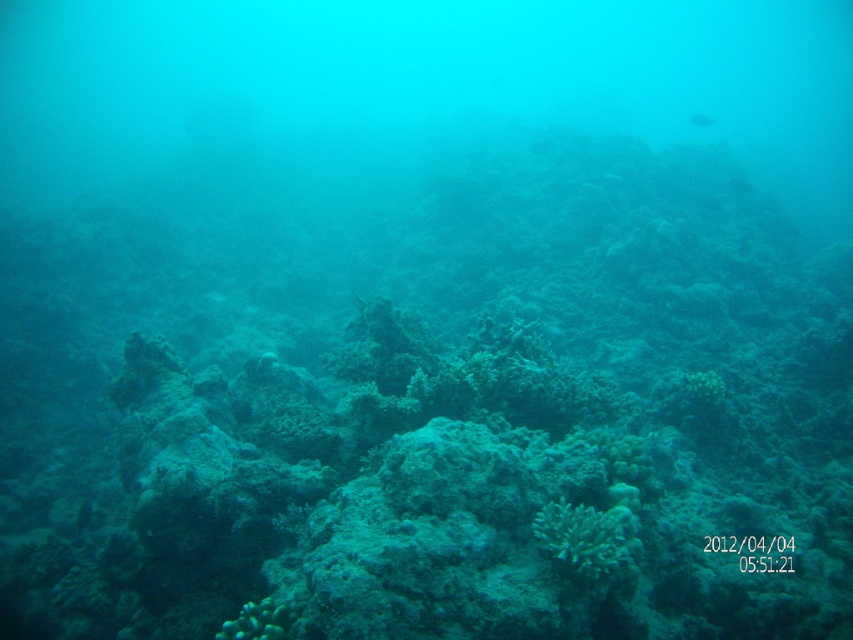
Question: In this image, where is green matte coral at center located relative to translucent greenish-blue fish at upper center?

Choices:
 (A) left
 (B) right

Answer: (A)

Question: Does green matte coral at center appear on the right side of translucent greenish-blue fish at upper center?

Choices:
 (A) yes
 (B) no

Answer: (B)

Question: Does green matte coral at center have a greater width compared to translucent greenish-blue fish at upper center?

Choices:
 (A) no
 (B) yes

Answer: (A)

Question: Which point is closer to the camera taking this photo?

Choices:
 (A) (711, 116)
 (B) (630, 525)

Answer: (B)

Question: Which object is closer to the camera taking this photo?

Choices:
 (A) green matte coral at center
 (B) translucent greenish-blue fish at upper center

Answer: (A)